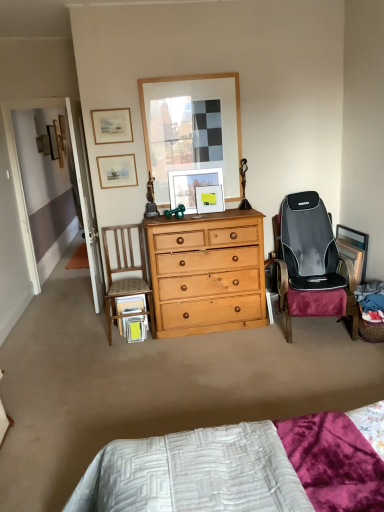
Question: Looking at their shapes, would you say matte wooden picture frame at upper left, arranged as the fourth picture frame when viewed from the left, is wider or thinner than matte wooden picture frame at upper left, acting as the 6th picture frame starting from the back?

Choices:
 (A) wide
 (B) thin

Answer: (A)

Question: From the image's perspective, is matte wooden picture frame at upper left, the third picture frame from the front, located above or below matte wooden picture frame at upper left, which is counted as the 3th picture frame, starting from the top?

Choices:
 (A) above
 (B) below

Answer: (B)

Question: Which object is positioned closest to the matte wooden picture frame at upper left, the 5th picture frame positioned from the bottom?

Choices:
 (A) wooden picture frame at upper left, the 2th picture frame from the top
 (B) matte wooden picture frame at upper left, the third picture frame from the front
 (C) matte wooden picture frame at center, which is counted as the third picture frame, starting from the right
 (D) wooden chair with upholstered seat at left
 (E) wooden picture frame at right, which appears as the 1th picture frame when viewed from the right

Answer: (B)

Question: Considering the real-world distances, which object is closest to the matte wooden picture frame at upper left, arranged as the fourth picture frame when viewed from the left?

Choices:
 (A) matte wooden picture frame at upper left, which appears as the 3th picture frame when viewed from the left
 (B) wooden picture frame at right, which appears as the 7th picture frame when viewed from the top
 (C) wooden picture frame at upper left, which is the second picture frame in left-to-right order
 (D) matte wooden picture frame at center, which appears as the 5th picture frame when viewed from the top
 (E) wooden picture frame at upper left, placed as the seventh picture frame when sorted from right to left

Answer: (A)